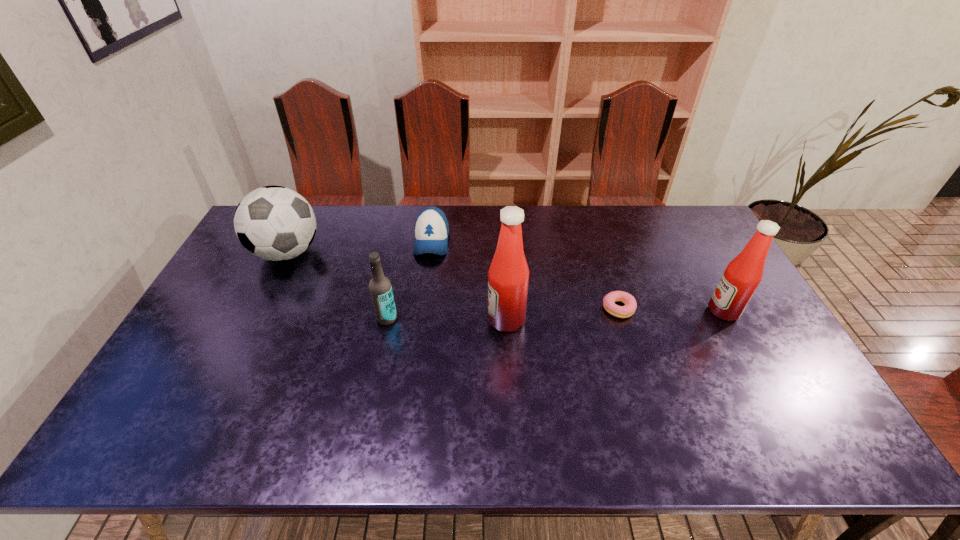
The height and width of the screenshot is (540, 960). I want to click on the third object from right to left, so click(508, 276).

The width and height of the screenshot is (960, 540). In order to click on the taller condiment in this screenshot , I will do `click(508, 276)`.

At what (x,y) coordinates should I click in order to perform the action: click on the rightmost object. Please return your answer as a coordinate pair (x, y). This screenshot has width=960, height=540. Looking at the image, I should click on (742, 276).

Identify the location of the right condiment. Image resolution: width=960 pixels, height=540 pixels. (742, 276).

Identify the location of the fifth tallest object. (431, 229).

Identify the location of the fourth object from right to left. Image resolution: width=960 pixels, height=540 pixels. (431, 229).

Image resolution: width=960 pixels, height=540 pixels. I want to click on soccer ball, so click(x=274, y=223).

Locate an element on the screen. The image size is (960, 540). beer bottle is located at coordinates (380, 287).

At what (x,y) coordinates should I click in order to perform the action: click on doughnut. Please return your answer as a coordinate pair (x, y). This screenshot has width=960, height=540. Looking at the image, I should click on 628,309.

This screenshot has height=540, width=960. I want to click on the second object from right to left, so click(x=628, y=309).